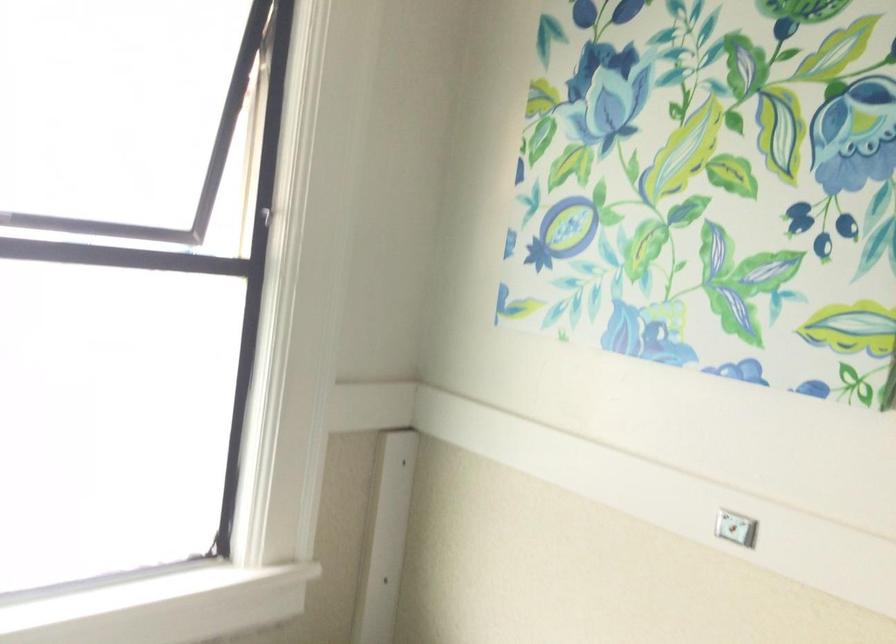
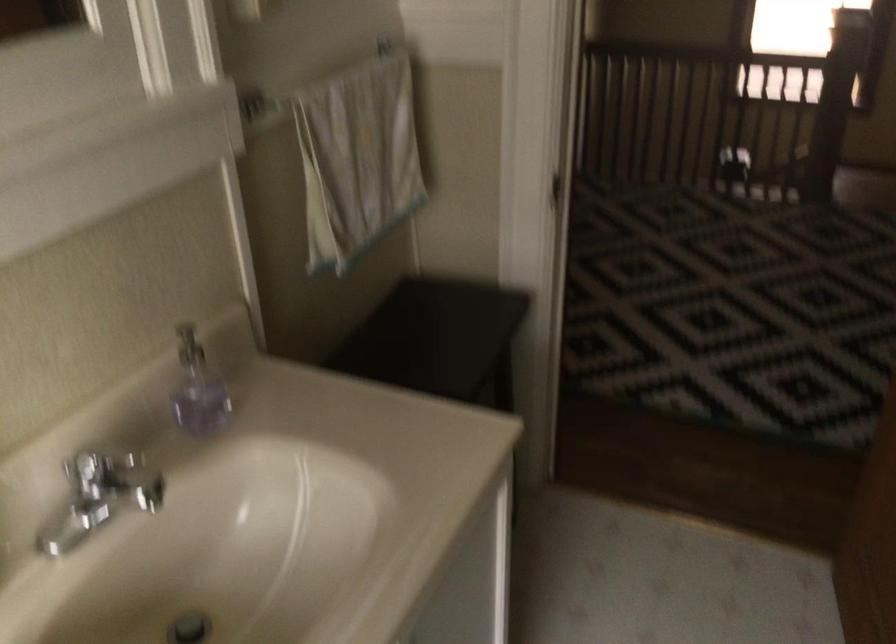
How did the camera likely rotate?

The camera's rotation is toward right-down.